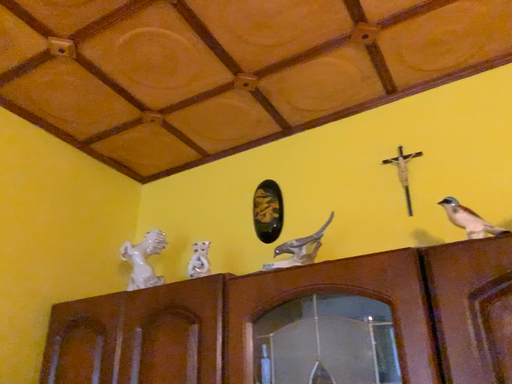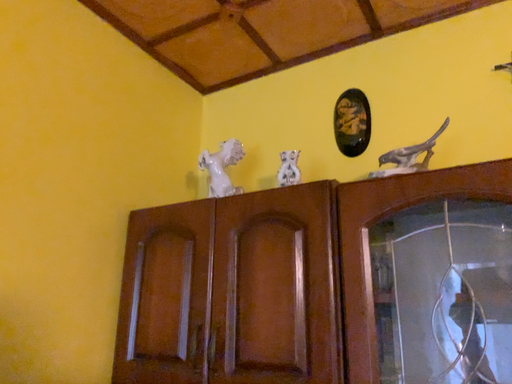
Question: Which way did the camera rotate in the video?

Choices:
 (A) rotated upward
 (B) rotated downward

Answer: (B)